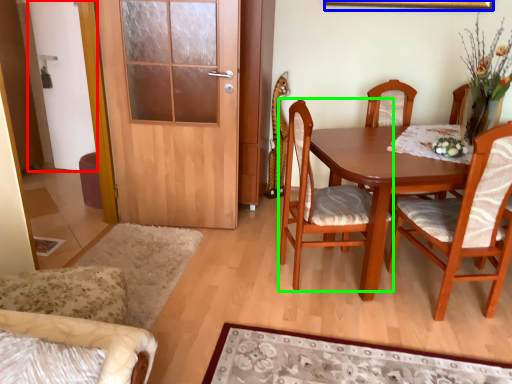
Question: Estimate the real-world distances between objects in this image. Which object is farther from screen door (highlighted by a red box), picture frame (highlighted by a blue box) or chair (highlighted by a green box)?

Choices:
 (A) picture frame
 (B) chair

Answer: (A)